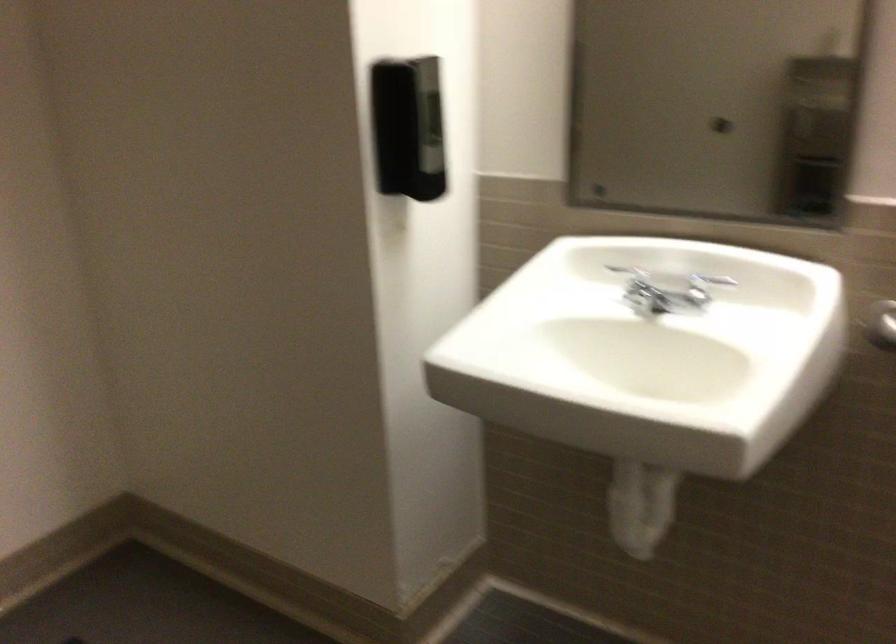
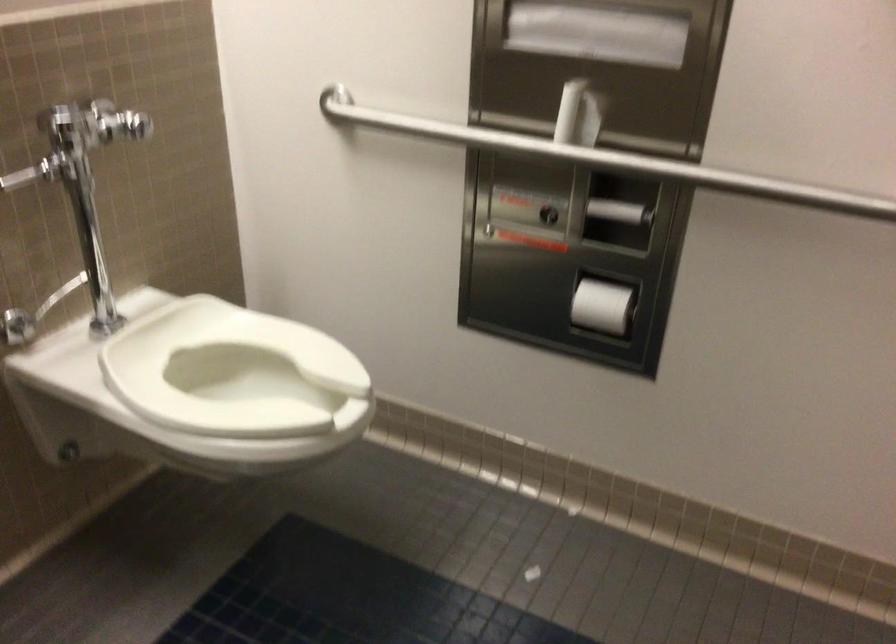
How did the camera likely rotate?

The camera rotated toward right-down.